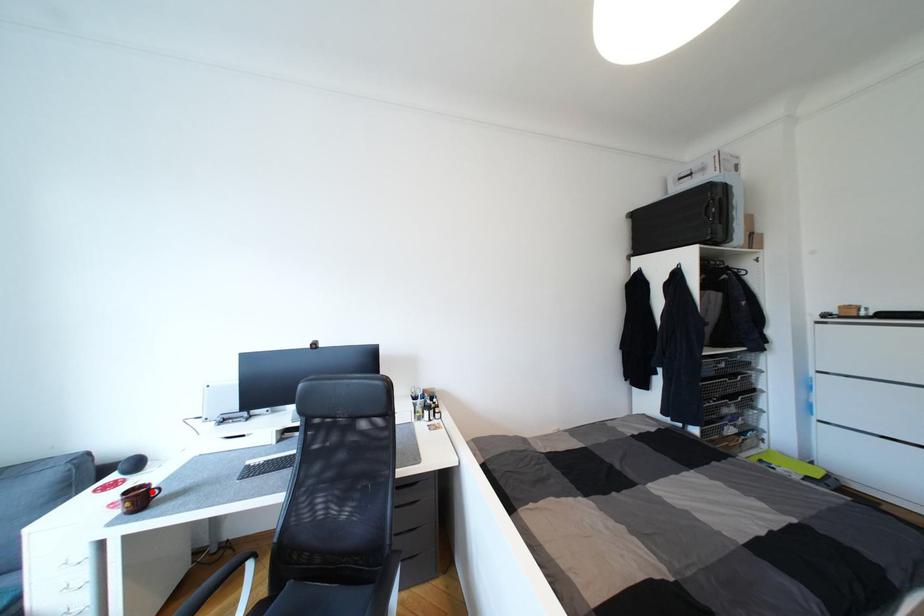
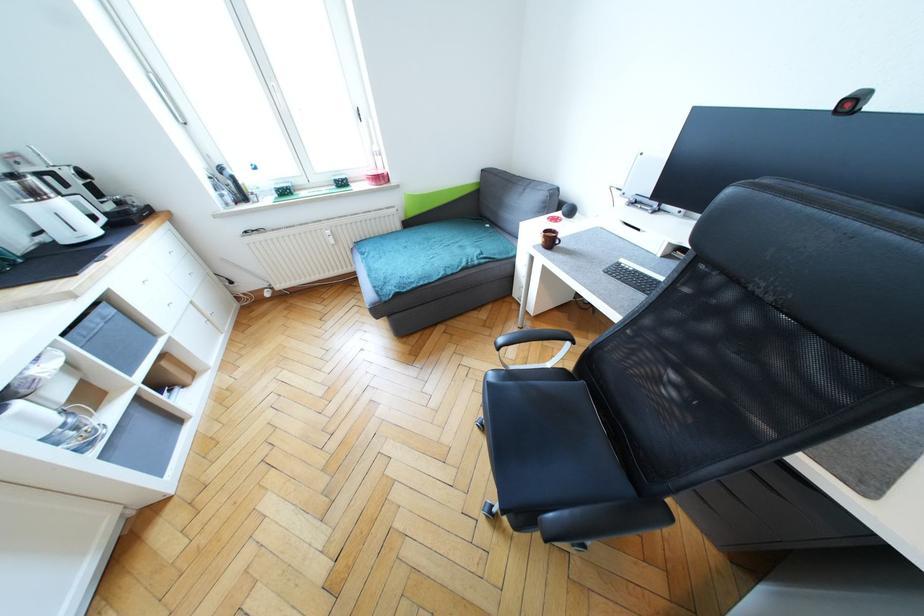
Question: I am providing you with two images of the same scene from different viewpoints. Image1 has a red point marked. In image2, the corresponding 3D location appears at what relative position? Reply with the corresponding letter.

Choices:
 (A) Closer
 (B) Farther

Answer: (A)